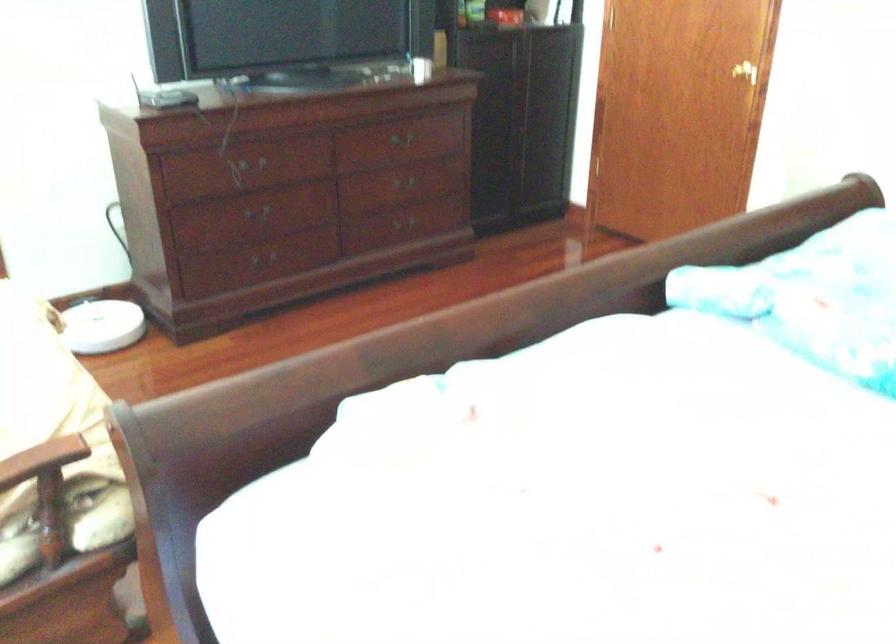
Find where to turn the gold door handle. Please return your answer as a coordinate pair (x, y).

(745, 71)